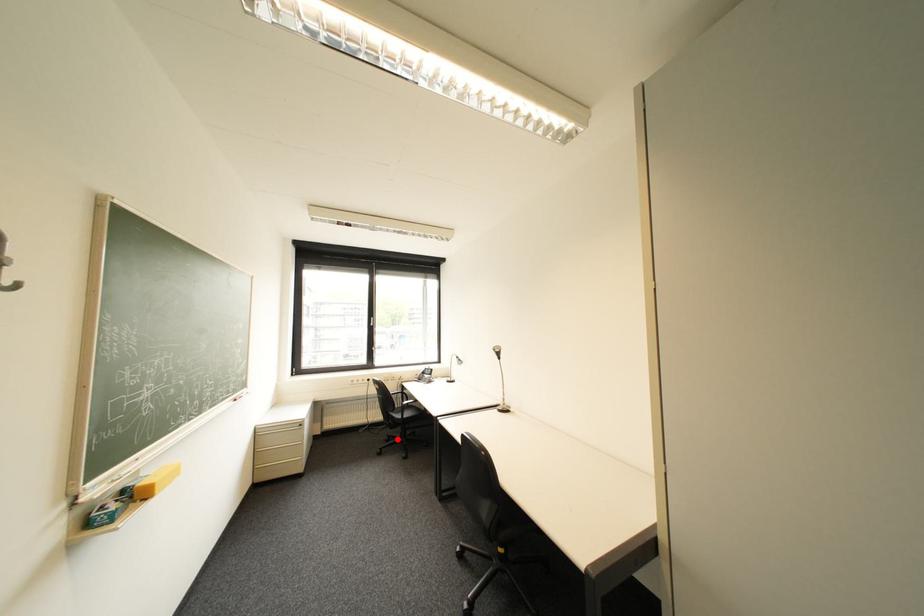
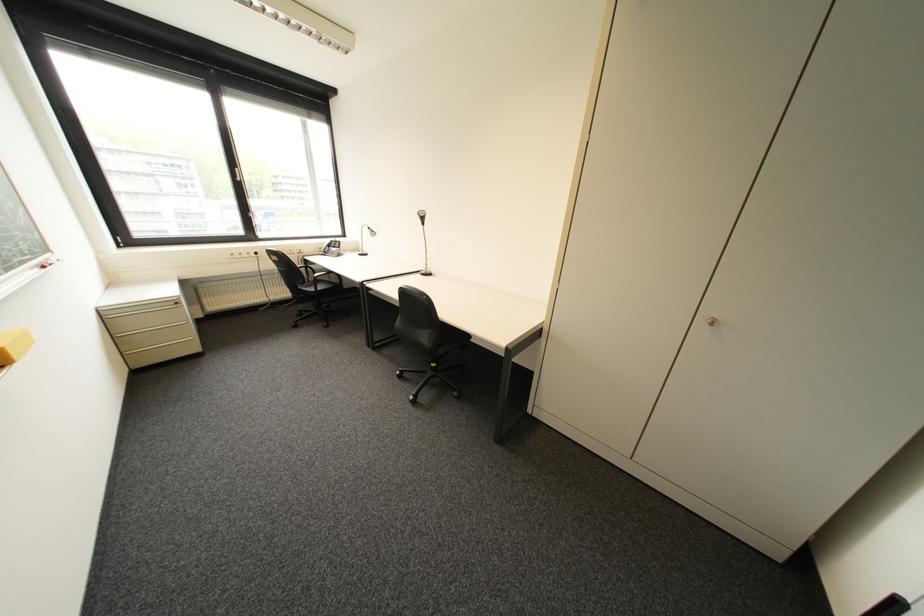
Question: I am providing you with two images of the same scene from different viewpoints. A red point is shown in image1. For the corresponding object point in image2, is it positioned nearer or farther from the camera?

Choices:
 (A) Nearer
 (B) Farther

Answer: (A)